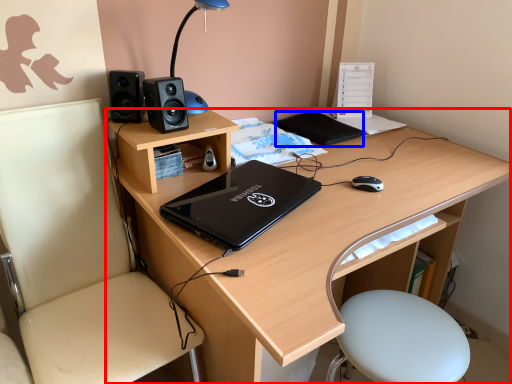
Question: Among these objects, which one is farthest to the camera, desk (highlighted by a red box) or notepad (highlighted by a blue box)?

Choices:
 (A) desk
 (B) notepad

Answer: (B)